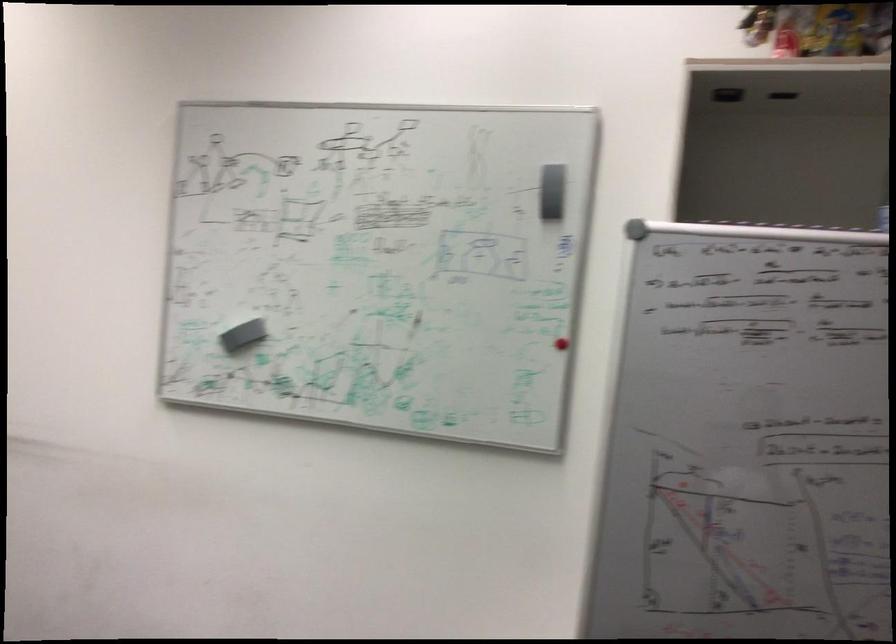
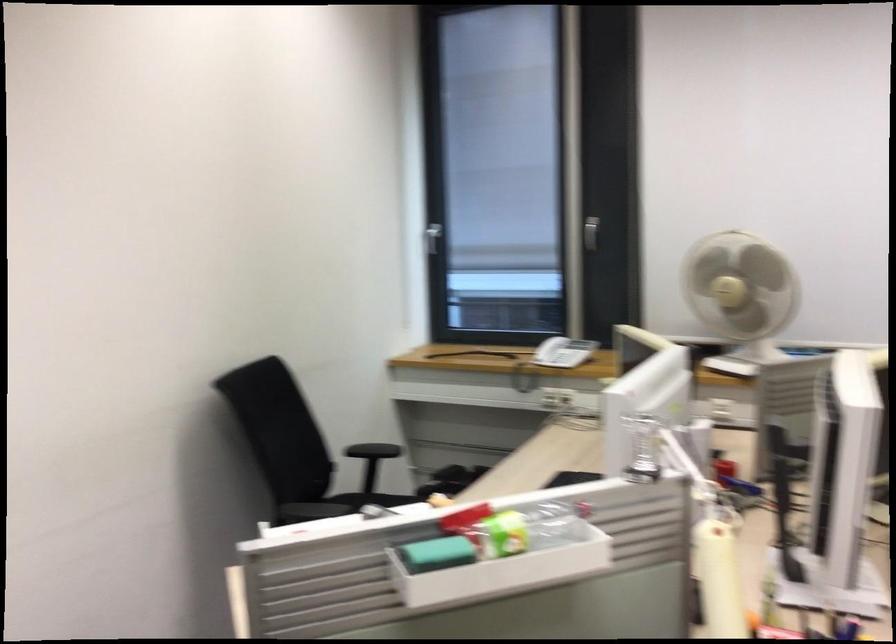
Question: The camera is either moving clockwise (left) or counter-clockwise (right) around the object. The first image is from the beginning of the video and the second image is from the end. Is the camera moving left or right when shooting the video?

Choices:
 (A) Left
 (B) Right

Answer: (B)